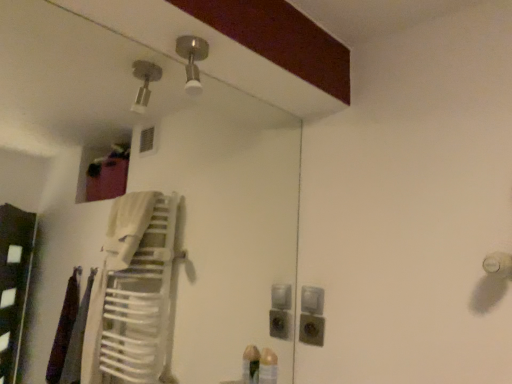
Locate an element on the screen. satin silver switch at center is located at coordinates (312, 300).

Describe the element at coordinates (192, 60) in the screenshot. This screenshot has height=384, width=512. I see `satin nickel light fixture at upper center` at that location.

This screenshot has width=512, height=384. Describe the element at coordinates (311, 329) in the screenshot. I see `matte gray outlet at lower center` at that location.

Where is `satin silver switch at center`? satin silver switch at center is located at coordinates pos(312,300).

Between satin silver switch at center and satin nickel light fixture at upper center, which one has smaller size?

satin silver switch at center is smaller.

Is satin silver switch at center not inside satin nickel light fixture at upper center?

Yes.

Is satin silver switch at center taller than satin nickel light fixture at upper center?

No, satin silver switch at center is not taller than satin nickel light fixture at upper center.

From the picture: Is satin silver switch at center touching satin nickel light fixture at upper center?

They are not placed beside each other.

From the image's perspective, which is above, matte gray outlet at lower center or satin nickel light fixture at upper center?

satin nickel light fixture at upper center is shown above in the image.

Which object is wider, matte gray outlet at lower center or satin nickel light fixture at upper center?

satin nickel light fixture at upper center is wider.

Is matte gray outlet at lower center inside or outside of satin nickel light fixture at upper center?

The correct answer is: outside.

Between matte gray outlet at lower center and satin nickel light fixture at upper center, which one is positioned behind?

Positioned behind is matte gray outlet at lower center.

Is point (185, 42) closer or farther from the camera than point (313, 332)?

Point (185, 42) appears to be closer to the viewer than point (313, 332).

From a real-world perspective, which object rests below the other?

From a 3D spatial view, matte gray outlet at lower center is below.

Does satin nickel light fixture at upper center have a greater height compared to matte gray outlet at lower center?

Yes, satin nickel light fixture at upper center is taller than matte gray outlet at lower center.

Does satin nickel light fixture at upper center turn towards satin silver switch at center?

No.

Is satin silver switch at center located within satin nickel light fixture at upper center?

No, satin silver switch at center is not surrounded by satin nickel light fixture at upper center.

Is there a large distance between satin nickel light fixture at upper center and satin silver switch at center?

They are positioned close to each other.

From a real-world perspective, is satin nickel light fixture at upper center beneath satin silver switch at center?

No, from a real-world perspective, satin nickel light fixture at upper center is not under satin silver switch at center.

This screenshot has width=512, height=384. I want to click on electric outlet in front of the satin silver switch at center, so click(x=311, y=329).

Is matte gray outlet at lower center outside of satin silver switch at center?

Yes.

From a real-world perspective, does matte gray outlet at lower center stand above satin silver switch at center?

No, from a real-world perspective, matte gray outlet at lower center is not over satin silver switch at center

From a real-world perspective, is satin silver switch at center on top of matte gray outlet at lower center?

Correct, in the physical world, satin silver switch at center is higher than matte gray outlet at lower center.

Would you say satin silver switch at center is outside matte gray outlet at lower center?

Indeed, satin silver switch at center is completely outside matte gray outlet at lower center.

Can you confirm if satin silver switch at center is positioned to the right of matte gray outlet at lower center?

Indeed, satin silver switch at center is positioned on the right side of matte gray outlet at lower center.

I want to click on light fixture above the satin silver switch at center (from the image's perspective), so click(192, 60).

The width and height of the screenshot is (512, 384). I want to click on electric outlet lying on the right of satin nickel light fixture at upper center, so click(311, 329).

Which object lies nearer to the anchor point matte gray outlet at lower center, satin silver switch at center or satin nickel light fixture at upper center?

Among the two, satin silver switch at center is located nearer to matte gray outlet at lower center.

Based on their spatial positions, is matte gray outlet at lower center or satin nickel light fixture at upper center further from satin silver switch at center?

Among the two, satin nickel light fixture at upper center is located further to satin silver switch at center.

Consider the image. Considering their positions, is satin nickel light fixture at upper center positioned closer to satin silver switch at center than matte gray outlet at lower center?

The object closer to satin silver switch at center is matte gray outlet at lower center.

Looking at the image, which one is located closer to matte gray outlet at lower center, satin nickel light fixture at upper center or satin silver switch at center?

satin silver switch at center lies closer to matte gray outlet at lower center than the other object.

From the image, which object appears to be nearer to satin nickel light fixture at upper center, satin silver switch at center or matte gray outlet at lower center?

Based on the image, satin silver switch at center appears to be nearer to satin nickel light fixture at upper center.

Considering their positions, is matte gray outlet at lower center positioned further to satin nickel light fixture at upper center than satin silver switch at center?

The object further to satin nickel light fixture at upper center is matte gray outlet at lower center.

In order to click on light switch between satin nickel light fixture at upper center and matte gray outlet at lower center vertically in this screenshot , I will do `click(312, 300)`.